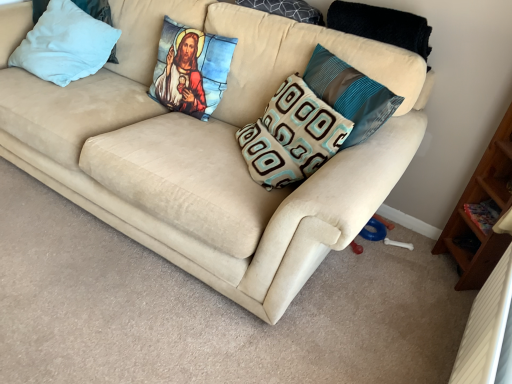
Question: Which direction should I rotate to look at brown and light blue patterned pillow at center, marked as the third pillow in a right-to-left arrangement, — up or down?

Choices:
 (A) up
 (B) down

Answer: (A)

Question: Can you confirm if suede beige couch at center is smaller than light blue fabric pillow at upper left, the fifth pillow in the right-to-left sequence?

Choices:
 (A) no
 (B) yes

Answer: (A)

Question: Does suede beige couch at center have a greater width compared to light blue fabric pillow at upper left, which is the 1th pillow in left-to-right order?

Choices:
 (A) yes
 (B) no

Answer: (A)

Question: From a real-world perspective, is suede beige couch at center beneath light blue fabric pillow at upper left, which is the 1th pillow in left-to-right order?

Choices:
 (A) no
 (B) yes

Answer: (B)

Question: From the image's perspective, is suede beige couch at center on top of light blue fabric pillow at upper left, which is the 1th pillow in left-to-right order?

Choices:
 (A) yes
 (B) no

Answer: (B)

Question: Can we say suede beige couch at center lies outside light blue fabric pillow at upper left, which is the 1th pillow in left-to-right order?

Choices:
 (A) yes
 (B) no

Answer: (A)

Question: Is the surface of suede beige couch at center in direct contact with light blue fabric pillow at upper left, the fifth pillow in the right-to-left sequence?

Choices:
 (A) yes
 (B) no

Answer: (B)

Question: Does dark gray textured pillow at upper center, arranged as the 2th pillow when viewed from the right, lie behind brown and light blue patterned pillow at center, placed as the third pillow when sorted from left to right?

Choices:
 (A) yes
 (B) no

Answer: (A)

Question: From the image's perspective, does dark gray textured pillow at upper center, which is counted as the 4th pillow, starting from the left, appear higher than brown and light blue patterned pillow at center, placed as the third pillow when sorted from left to right?

Choices:
 (A) no
 (B) yes

Answer: (B)

Question: Considering the relative sizes of dark gray textured pillow at upper center, which is counted as the 4th pillow, starting from the left, and brown and light blue patterned pillow at center, placed as the third pillow when sorted from left to right, in the image provided, is dark gray textured pillow at upper center, which is counted as the 4th pillow, starting from the left, shorter than brown and light blue patterned pillow at center, placed as the third pillow when sorted from left to right,?

Choices:
 (A) no
 (B) yes

Answer: (B)

Question: Does dark gray textured pillow at upper center, arranged as the 2th pillow when viewed from the right, have a smaller size compared to brown and light blue patterned pillow at center, placed as the third pillow when sorted from left to right?

Choices:
 (A) no
 (B) yes

Answer: (B)

Question: Is dark gray textured pillow at upper center, which is counted as the 4th pillow, starting from the left, looking in the opposite direction of brown and light blue patterned pillow at center, marked as the third pillow in a right-to-left arrangement?

Choices:
 (A) yes
 (B) no

Answer: (B)

Question: Is dark gray textured pillow at upper center, which is counted as the 4th pillow, starting from the left, bigger than brown and light blue patterned pillow at center, placed as the third pillow when sorted from left to right?

Choices:
 (A) yes
 (B) no

Answer: (B)

Question: Does brown and light blue patterned pillow at center, placed as the third pillow when sorted from left to right, have a larger size compared to stained glass pillow at upper center, the second pillow viewed from the left?

Choices:
 (A) yes
 (B) no

Answer: (A)